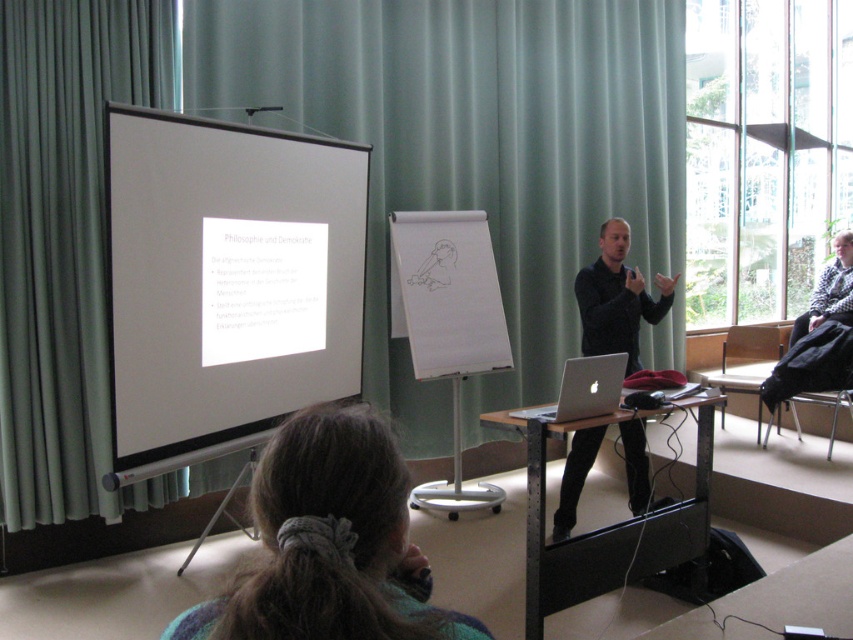
Does white glossy projection screen at upper left have a lesser width compared to dark brown hair at lower center?

Incorrect, white glossy projection screen at upper left's width is not less than dark brown hair at lower center's.

Is point (186, 291) positioned behind point (252, 593)?

Yes, point (186, 291) is farther from viewer.

You are a GUI agent. You are given a task and a screenshot of the screen. Output one action in this format:
    pyautogui.click(x=<x>, y=<y>)
    Task: Click on the white glossy projection screen at upper left
    
    Given the screenshot: What is the action you would take?
    pyautogui.click(x=225, y=284)

Can you confirm if black matte shirt at center is bigger than silver metallic laptop at center?

Yes.

I want to click on black matte shirt at center, so click(x=616, y=298).

The height and width of the screenshot is (640, 853). What are the coordinates of `black matte shirt at center` in the screenshot? It's located at (616, 298).

Is the position of dark brown hair at lower center less distant than that of silver metallic laptop at center?

Yes, it is in front of silver metallic laptop at center.

Which is more to the right, dark brown hair at lower center or silver metallic laptop at center?

silver metallic laptop at center

This screenshot has width=853, height=640. Identify the location of dark brown hair at lower center. (329, 545).